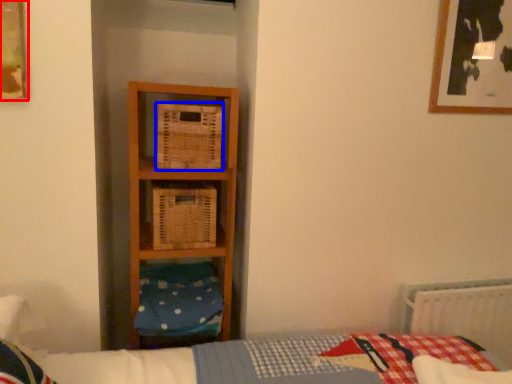
Question: Which object is closer to the camera taking this photo, picture frame (highlighted by a red box) or crate (highlighted by a blue box)?

Choices:
 (A) picture frame
 (B) crate

Answer: (A)